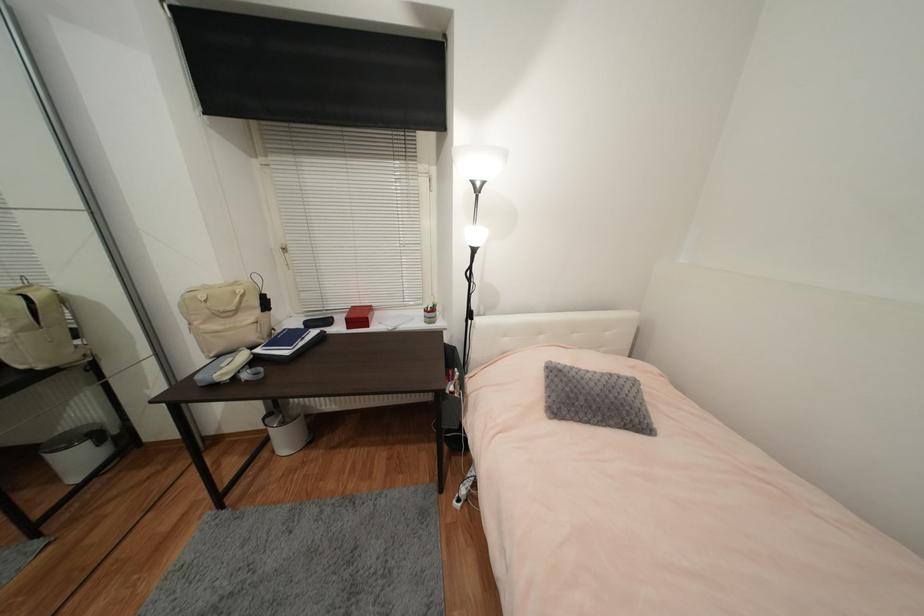
You are a GUI agent. You are given a task and a screenshot of the screen. Output one action in this format:
    pyautogui.click(x=<x>, y=<y>)
    Task: Click on the window handle
    
    Given the screenshot: What is the action you would take?
    pyautogui.click(x=285, y=254)